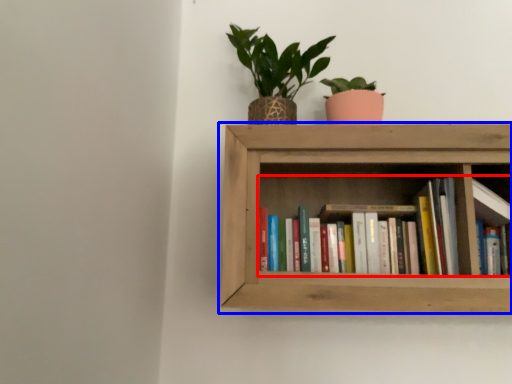
Question: Which object is further to the camera taking this photo, book (highlighted by a red box) or shelf (highlighted by a blue box)?

Choices:
 (A) book
 (B) shelf

Answer: (A)